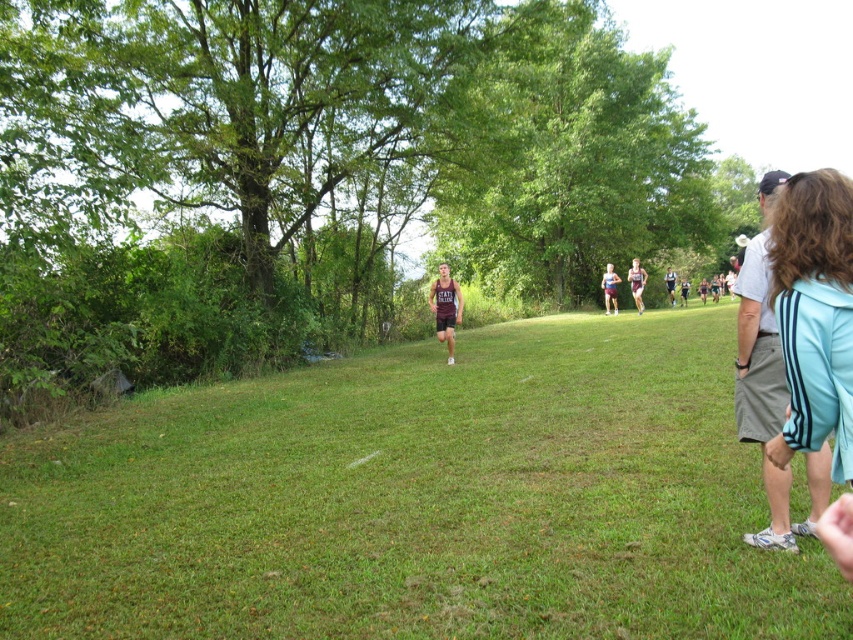
You are a runner in the cross country race and you see the green grassy field at center and the dark brown athletic shorts at center. Which object is located to the left of the other?

The green grassy field at center is to the left of dark brown athletic shorts at center.

You are a runner in the cross country race and you see two points marked on your map. The first point is at point [538,44] and the second point is at point [811,513]. Which point is closer to you as you run towards the camera?

Point [811,513] is closer to you because it is in front of point [538,44].

You are a photographer positioned at the camera location. You want to capture a photo of both the point at coordinates point (490, 464) and point (672, 284). Which point should you focus on first to ensure both are in focus?

You should focus on point (490, 464) first because it is closer to the camera than point (672, 284), ensuring both will be in focus when using depth of field appropriately.